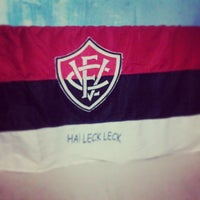
The width and height of the screenshot is (200, 200). What are the coordinates of `white wall` in the screenshot? It's located at (116, 173).